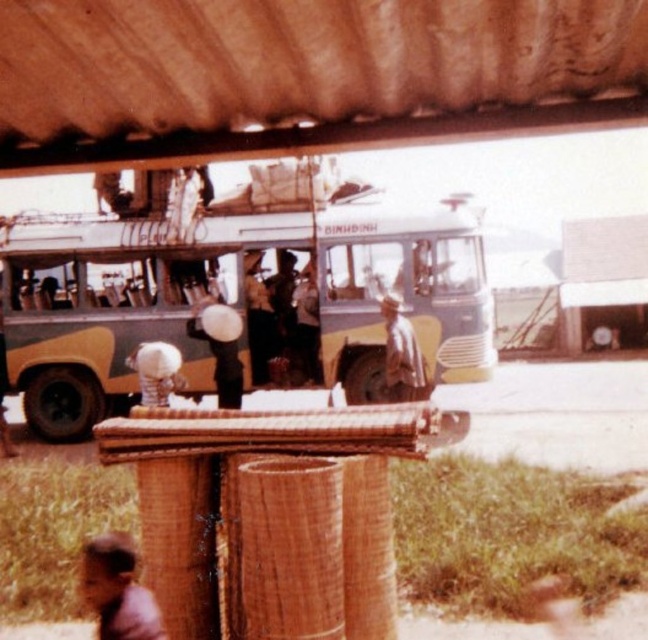
Question: Which object is closer to the camera taking this photo?

Choices:
 (A) brown leather jacket at lower left
 (B) brown woven hat at center
 (C) white matte hat at center

Answer: (A)

Question: Which object is positioned farthest from the brown woven hat at center?

Choices:
 (A) brown leather jacket at lower left
 (B) yellow matte bus at center
 (C) white matte hat at center

Answer: (A)

Question: Is yellow matte bus at center to the right of brown woven hat at center from the viewer's perspective?

Choices:
 (A) no
 (B) yes

Answer: (A)

Question: Is yellow matte bus at center to the left of white matte hat at center from the viewer's perspective?

Choices:
 (A) yes
 (B) no

Answer: (B)

Question: Which point is closer to the camera?

Choices:
 (A) (139, 605)
 (B) (411, 314)

Answer: (A)

Question: Is brown woven hat at center closer to the viewer compared to white matte hat at center?

Choices:
 (A) yes
 (B) no

Answer: (A)